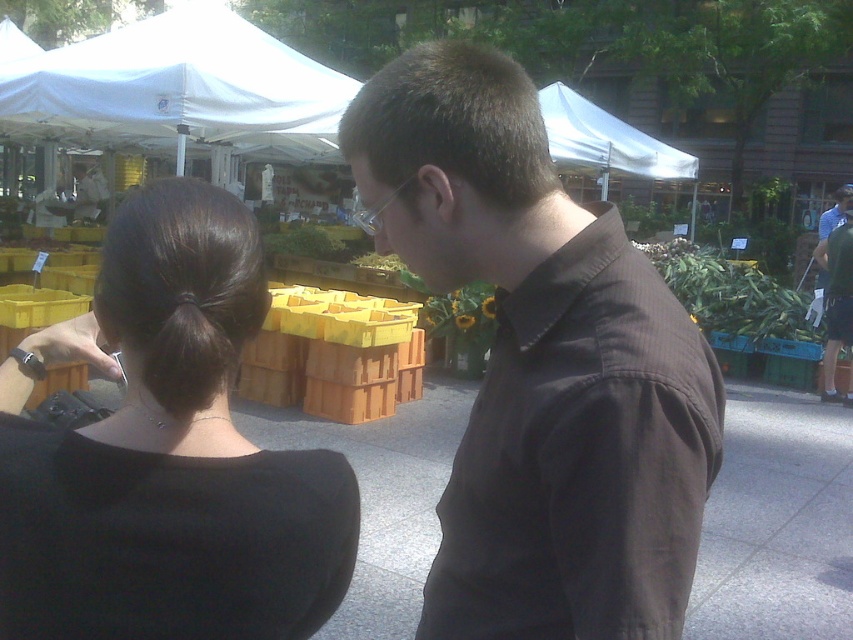
Question: Is the position of black fabric shirt at upper left less distant than that of green leafy produce at center?

Choices:
 (A) yes
 (B) no

Answer: (A)

Question: Is brown smooth shirt at center further to camera compared to green leafy produce at center?

Choices:
 (A) yes
 (B) no

Answer: (B)

Question: Which object is closer to the camera taking this photo?

Choices:
 (A) brown smooth shirt at center
 (B) green leafy produce at center
 (C) black fabric shirt at upper left
 (D) dark green t-shirt at right

Answer: (A)

Question: Can you confirm if white fabric canopy at upper center is positioned above dark green t-shirt at right?

Choices:
 (A) no
 (B) yes

Answer: (B)

Question: Among these points, which one is farthest from the camera?

Choices:
 (A) (805, 310)
 (B) (120, 93)
 (C) (459, 492)
 (D) (637, 145)

Answer: (D)

Question: Estimate the real-world distances between objects in this image. Which object is closer to the black fabric shirt at upper left?

Choices:
 (A) white fabric canopy at upper center
 (B) dark green t-shirt at right

Answer: (B)